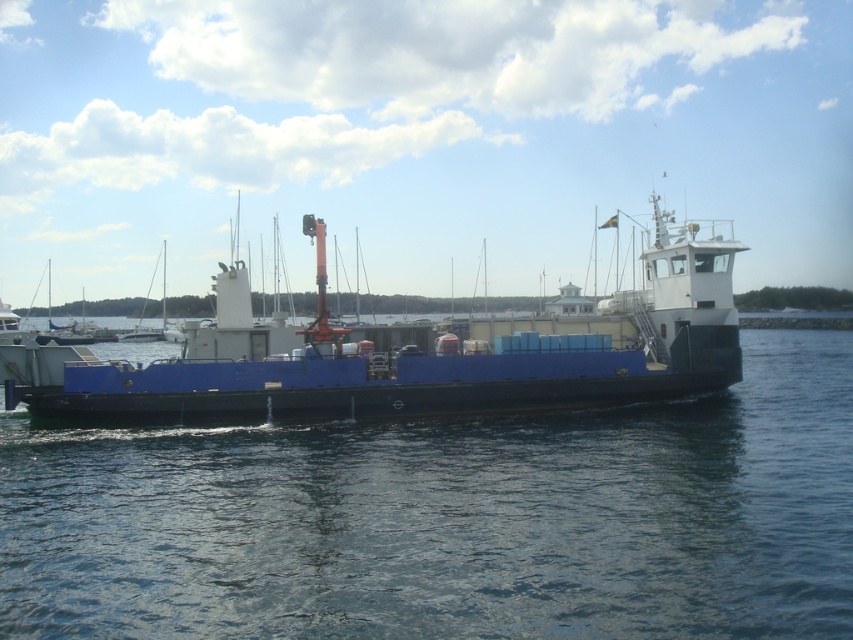
Question: Can you confirm if blue water at center is thinner than blue matte boat at center?

Choices:
 (A) yes
 (B) no

Answer: (A)

Question: Observing the image, what is the correct spatial positioning of blue water at center in reference to blue matte boat at center?

Choices:
 (A) above
 (B) below

Answer: (B)

Question: Which object is farther from the camera taking this photo?

Choices:
 (A) blue water at center
 (B) blue matte boat at center

Answer: (B)

Question: Is blue water at center behind blue matte boat at center?

Choices:
 (A) no
 (B) yes

Answer: (A)